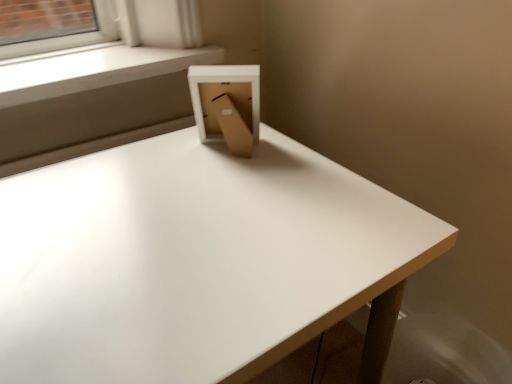
Question: From the image's perspective, is white smooth window sill at upper left located above or below white matte table at center?

Choices:
 (A) below
 (B) above

Answer: (B)

Question: In the image, is white smooth window sill at upper left positioned in front of or behind white matte table at center?

Choices:
 (A) front
 (B) behind

Answer: (B)

Question: Which object is the closest to the white matte table at center?

Choices:
 (A) white smooth window sill at upper left
 (B) cardboard box at center

Answer: (B)

Question: Which object is the closest to the white matte table at center?

Choices:
 (A) cardboard box at center
 (B) white smooth window sill at upper left

Answer: (A)